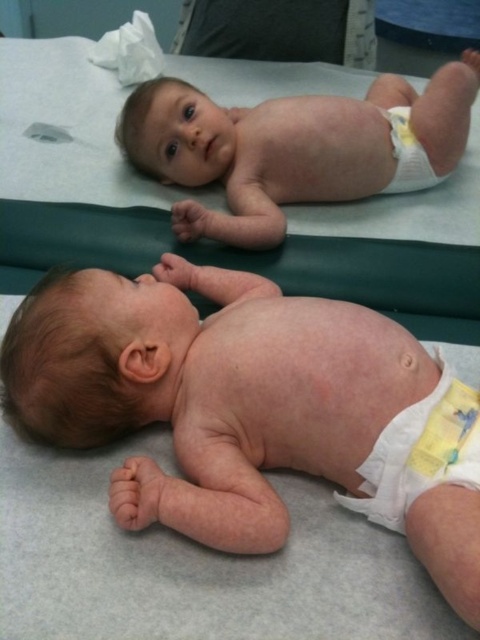
In the scene shown: You are a nurse in a clinic. You need to check the diaper of the baby with the rash. Which object is closer to the baby with the rash? The pink smooth skin at center or the yellow fabric diaper at lower right?

The yellow fabric diaper at lower right is closer to the baby with the rash because the pink smooth skin at center is to the left of the yellow fabric diaper at lower right, meaning the diaper is positioned to the right side of the baby with the rash.

You are a nurse in a clinic and need to move the smooth skin baby at upper center from its current position to the gray smooth hospital bed at center. Considering their widths, will the baby fit comfortably on the bed without needing to adjust the bed?

The gray smooth hospital bed at center is wider than the smooth skin baby at upper center, so the baby will fit comfortably on the bed without needing adjustments.